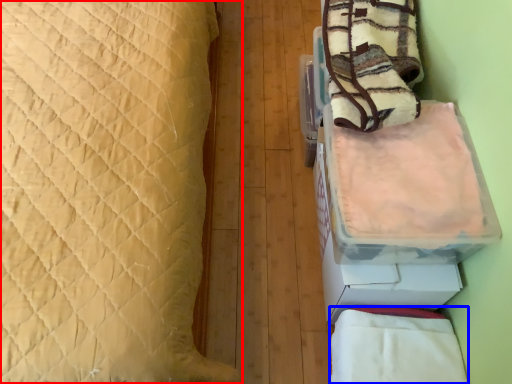
Question: Which point is closer to the camera, bed (highlighted by a red box) or blanket (highlighted by a blue box)?

Choices:
 (A) bed
 (B) blanket

Answer: (A)